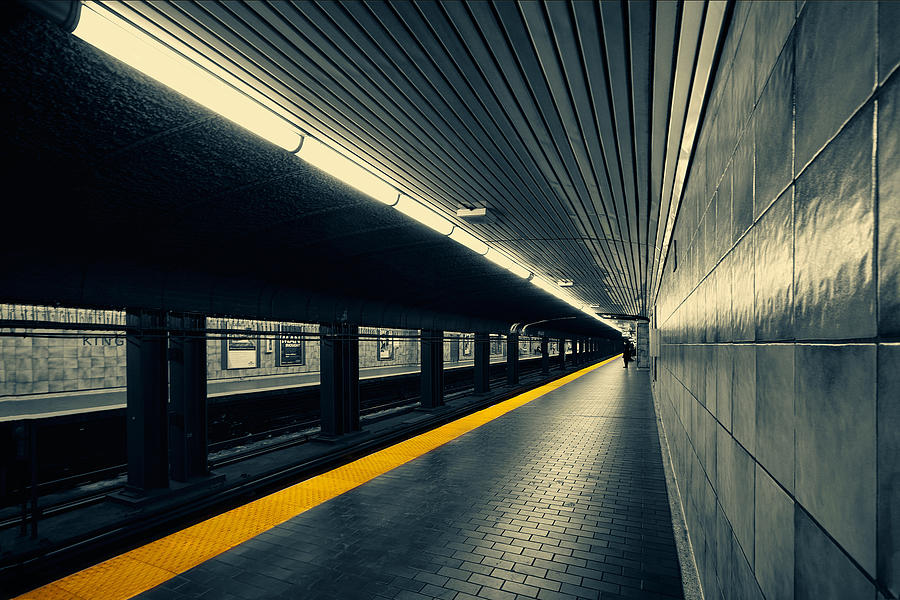
Find the location of `posters on the wall`. posters on the wall is located at coordinates (266, 352), (290, 319), (390, 352), (477, 354), (537, 357).